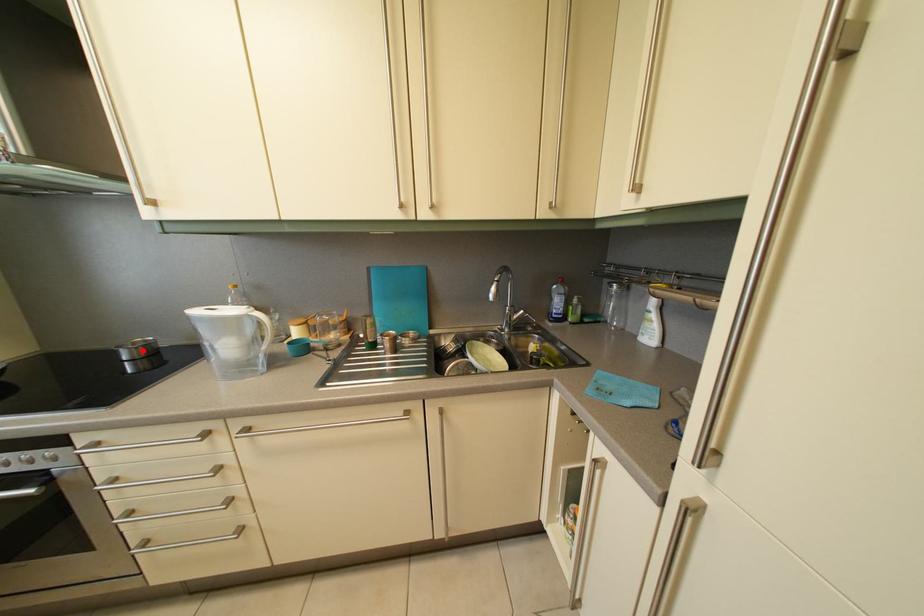
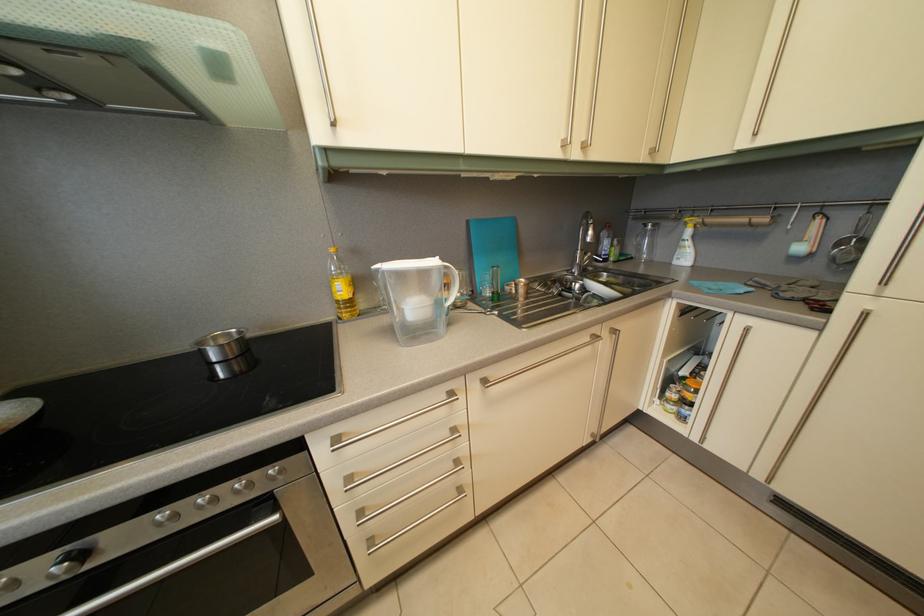
Locate, in the second image, the point that corresponds to the highlighted location in the first image.

(224, 346)